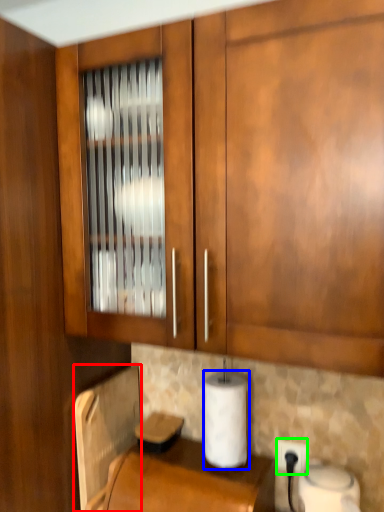
Question: Which is farther away from appliance (highlighted by a red box)? paper towel (highlighted by a blue box) or electric outlet (highlighted by a green box)?

Choices:
 (A) paper towel
 (B) electric outlet

Answer: (B)